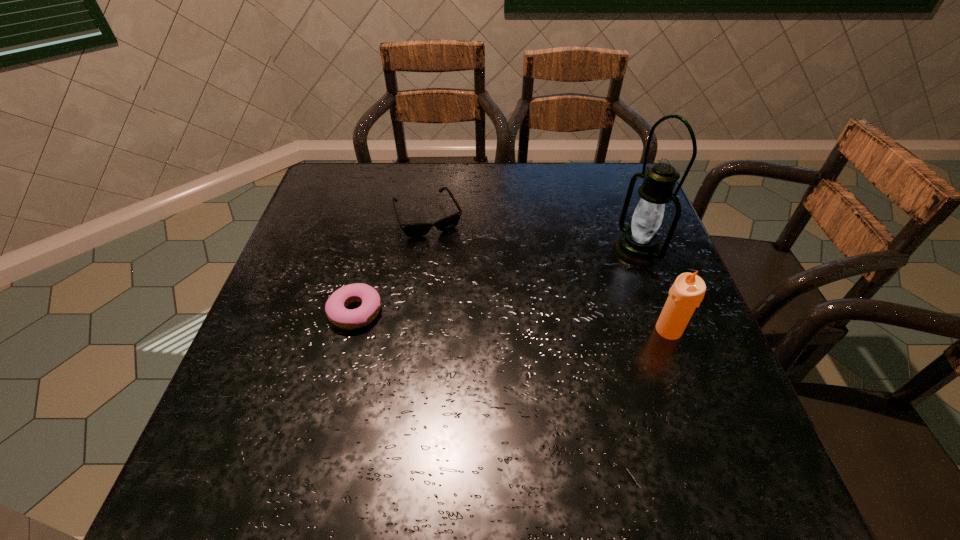
In the image, there is a desktop. In order to click on vacant space at the far left corner in this screenshot , I will do `click(364, 203)`.

In the image, there is a desktop. At what (x,y) coordinates should I click in order to perform the action: click on vacant space at the far right corner. Please return your answer as a coordinate pair (x, y). This screenshot has width=960, height=540. Looking at the image, I should click on (587, 188).

This screenshot has width=960, height=540. In the image, there is a desktop. Find the location of `vacant area at the near right corner`. vacant area at the near right corner is located at coordinates (710, 421).

Where is `free area in between the shortest object and the tallest object`? Image resolution: width=960 pixels, height=540 pixels. free area in between the shortest object and the tallest object is located at coordinates (496, 281).

Identify the location of unoccupied area between the sunglasses and the lantern. The image size is (960, 540). (533, 234).

Where is `blank region between the second shortest object and the lantern`? This screenshot has width=960, height=540. blank region between the second shortest object and the lantern is located at coordinates (533, 234).

Identify the location of free area in between the lantern and the third shortest object. (653, 290).

At what (x,y) coordinates should I click in order to perform the action: click on free spot between the doughnut and the sunglasses. Please return your answer as a coordinate pair (x, y). Looking at the image, I should click on (392, 265).

Find the location of a particular element. unoccupied area between the second shortest object and the lantern is located at coordinates (533, 234).

Image resolution: width=960 pixels, height=540 pixels. Identify the location of free space between the third tallest object and the candle. (549, 274).